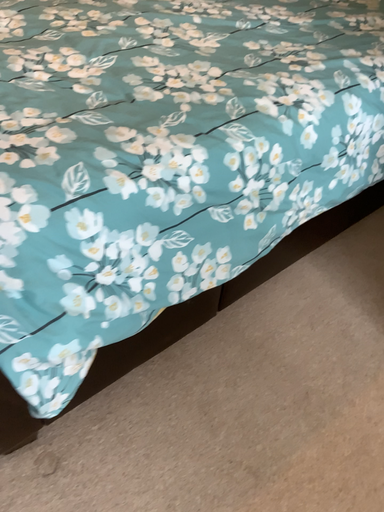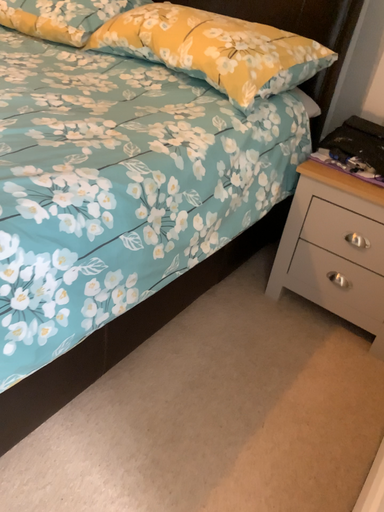
Question: How did the camera likely rotate when shooting the video?

Choices:
 (A) rotated downward
 (B) rotated upward

Answer: (B)